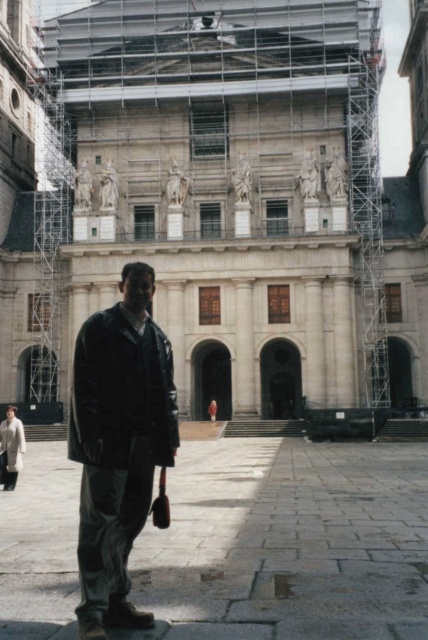
You are a construction worker assessing the renovation site. You see the smooth stone courtyard at center and the dark matte jacket at center. Which object occupies more space in the image?

The dark matte jacket at center occupies more space in the image because it is larger than the smooth stone courtyard at center.

Consider the image. You are a tourist visiting the historic site and want to take a photo of the white marble palace at center. Since you want the palace to be the main focus, should you stand closer to the smooth stone courtyard at center or further away from it?

To make the white marble palace at center the main focus in your photo, you should stand closer to the smooth stone courtyard at center. This will help emphasize the palace due to its larger size compared to the courtyard.